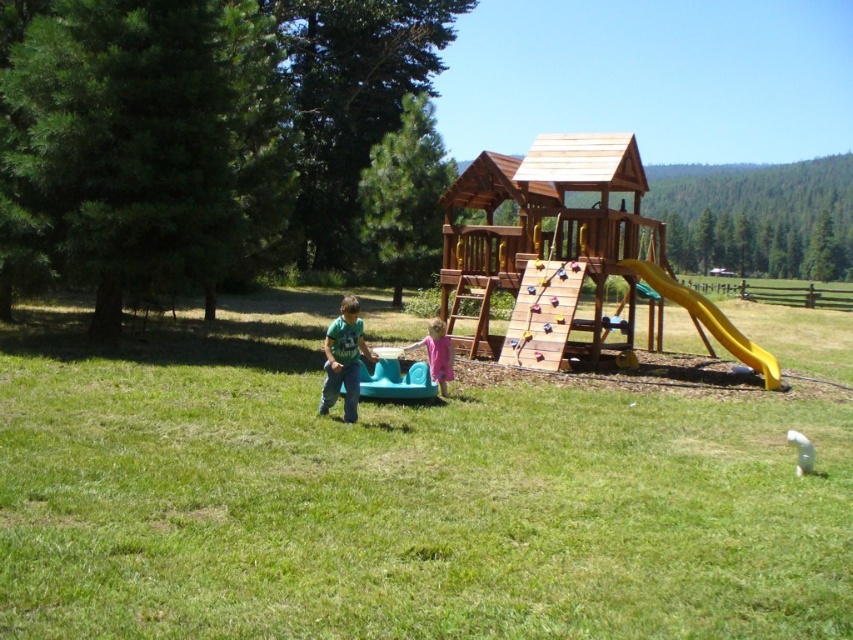
Is point (664, 298) in front of point (444, 374)?

No, it is not.

Is yellow matte slide at right wider than pink fabric dress at center?

Indeed, yellow matte slide at right has a greater width compared to pink fabric dress at center.

Locate an element on the screen. yellow matte slide at right is located at coordinates (708, 320).

Locate an element on the screen. The height and width of the screenshot is (640, 853). yellow matte slide at right is located at coordinates (708, 320).

Which of these two, pink fabric dress at center or white plastic ball at lower right, stands taller?

Standing taller between the two is pink fabric dress at center.

Does pink fabric dress at center appear over white plastic ball at lower right?

Yes.

The height and width of the screenshot is (640, 853). I want to click on pink fabric dress at center, so click(x=437, y=355).

Where is `pink fabric dress at center`? This screenshot has height=640, width=853. pink fabric dress at center is located at coordinates (437, 355).

Between point (289, 420) and point (442, 332), which one is positioned behind?

Positioned behind is point (442, 332).

At what (x,y) coordinates should I click in order to perform the action: click on green plastic wagon at center. Please return your answer as a coordinate pair (x, y). The width and height of the screenshot is (853, 640). Looking at the image, I should click on (399, 497).

Describe the element at coordinates (399, 497) in the screenshot. This screenshot has width=853, height=640. I see `green plastic wagon at center` at that location.

Image resolution: width=853 pixels, height=640 pixels. Find the location of `green plastic wagon at center`. green plastic wagon at center is located at coordinates (399, 497).